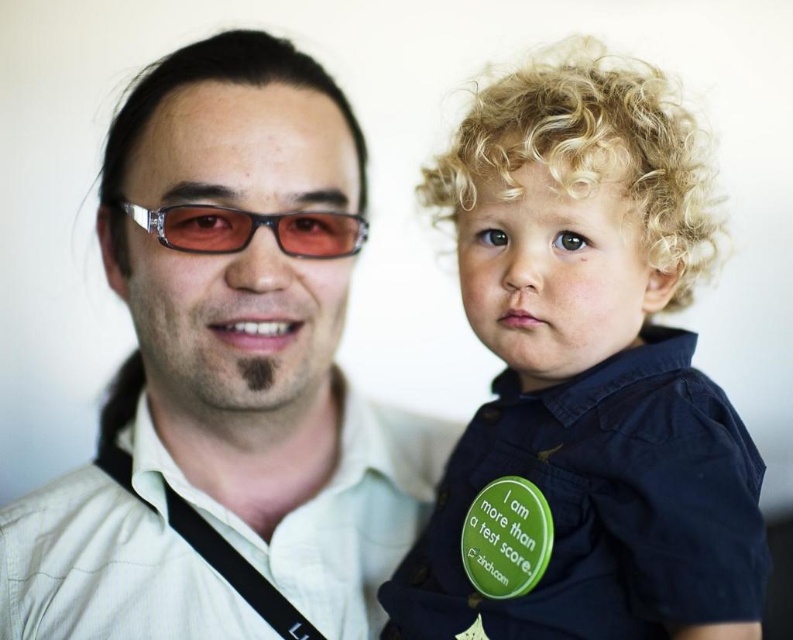
Does point (251, 100) come farther from viewer compared to point (301, 216)?

Yes, point (251, 100) is behind point (301, 216).

Is point (128, 109) closer to viewer compared to point (201, 234)?

No, (128, 109) is behind (201, 234).

You are a GUI agent. You are given a task and a screenshot of the screen. Output one action in this format:
    pyautogui.click(x=<x>, y=<y>)
    Task: Click on the matte white shirt at center
    This screenshot has height=640, width=793.
    Given the screenshot: What is the action you would take?
    228,374

Who is taller, dark blue shirt at right or green matte badge at right?

With more height is dark blue shirt at right.

I want to click on dark blue shirt at right, so click(585, 380).

Does sunglasses at left appear on the left side of green matte badge at right?

Yes, sunglasses at left is to the left of green matte badge at right.

Is sunglasses at left wider than green matte badge at right?

Yes.

Between point (192, 244) and point (523, 589), which one is positioned behind?

Point (192, 244)

Identify the location of sunglasses at left. The image size is (793, 640). (251, 228).